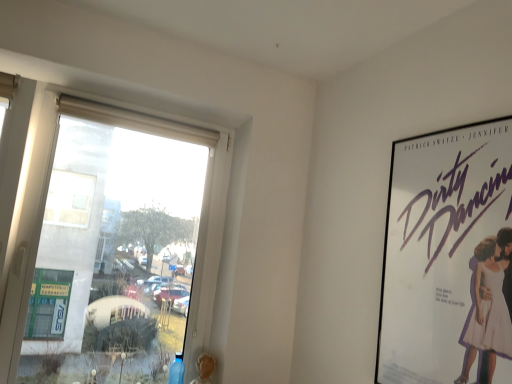
Question: Does transparent glass window at left have a lesser width compared to white paper poster at right?

Choices:
 (A) yes
 (B) no

Answer: (B)

Question: Considering the relative sizes of transparent glass window at left and white paper poster at right in the image provided, is transparent glass window at left smaller than white paper poster at right?

Choices:
 (A) no
 (B) yes

Answer: (A)

Question: Is transparent glass window at left taller than white paper poster at right?

Choices:
 (A) no
 (B) yes

Answer: (B)

Question: Is transparent glass window at left positioned before white paper poster at right?

Choices:
 (A) yes
 (B) no

Answer: (B)

Question: From the image's perspective, is transparent glass window at left beneath white paper poster at right?

Choices:
 (A) yes
 (B) no

Answer: (B)

Question: Considering the relative sizes of transparent glass window at left and white paper poster at right in the image provided, is transparent glass window at left wider than white paper poster at right?

Choices:
 (A) no
 (B) yes

Answer: (B)

Question: Is white paper poster at right at the left side of transparent glass window at left?

Choices:
 (A) yes
 (B) no

Answer: (B)

Question: Is white paper poster at right smaller than transparent glass window at left?

Choices:
 (A) yes
 (B) no

Answer: (A)

Question: Is white paper poster at right facing towards transparent glass window at left?

Choices:
 (A) no
 (B) yes

Answer: (A)

Question: From a real-world perspective, is white paper poster at right physically below transparent glass window at left?

Choices:
 (A) yes
 (B) no

Answer: (B)

Question: Is white paper poster at right positioned behind transparent glass window at left?

Choices:
 (A) yes
 (B) no

Answer: (B)

Question: Is white paper poster at right bigger than transparent glass window at left?

Choices:
 (A) no
 (B) yes

Answer: (A)

Question: Is transparent glass window at left to the left or to the right of white paper poster at right in the image?

Choices:
 (A) right
 (B) left

Answer: (B)